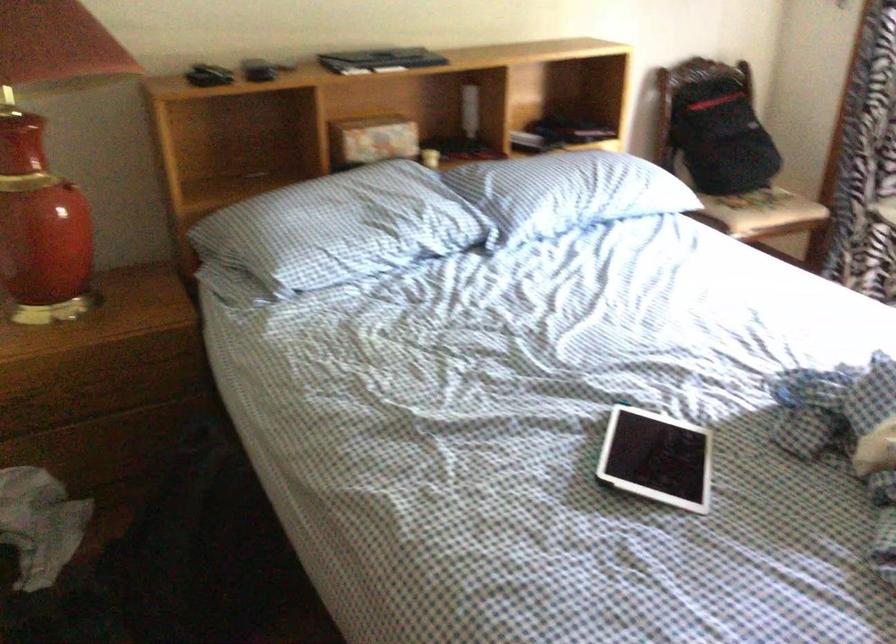
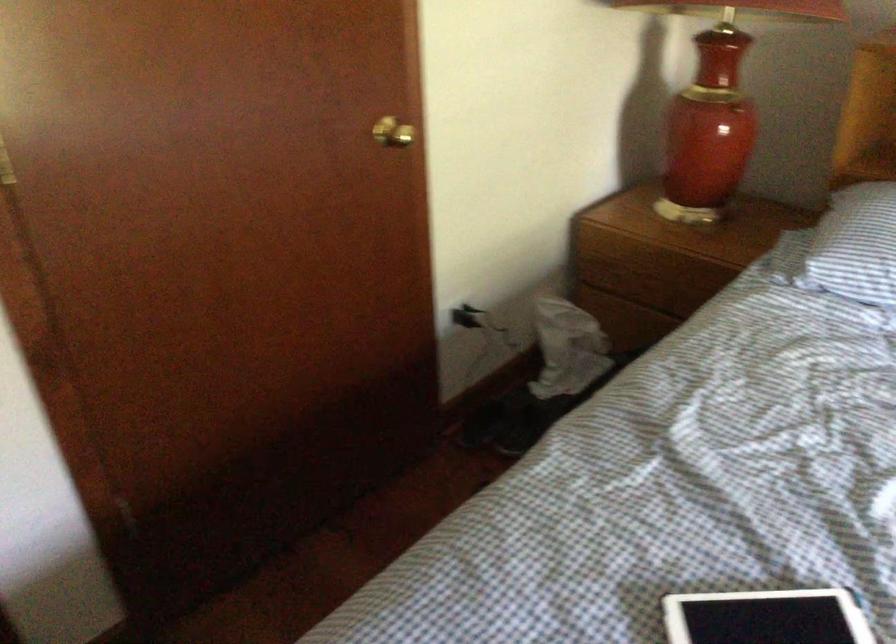
How did the camera likely rotate?

The camera rotated toward left-down.